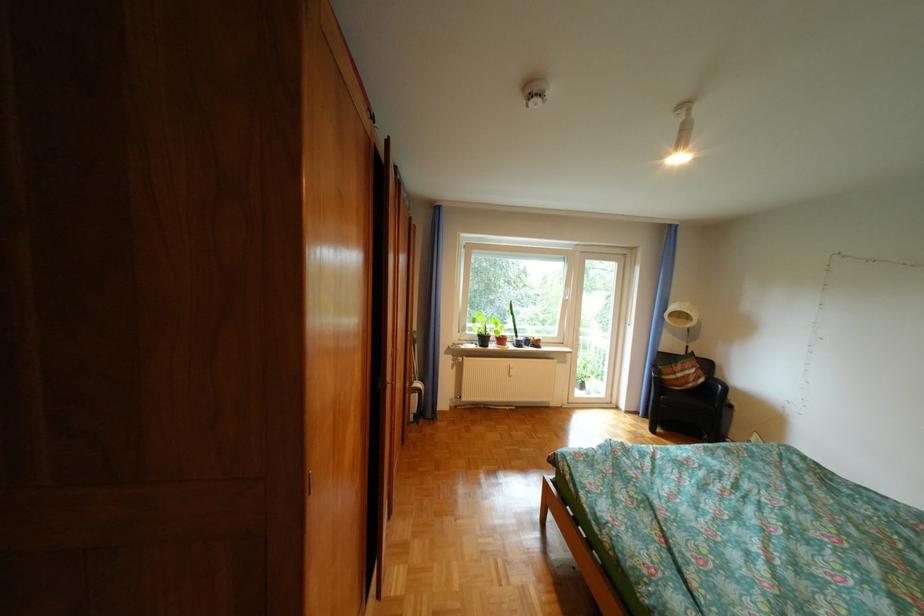
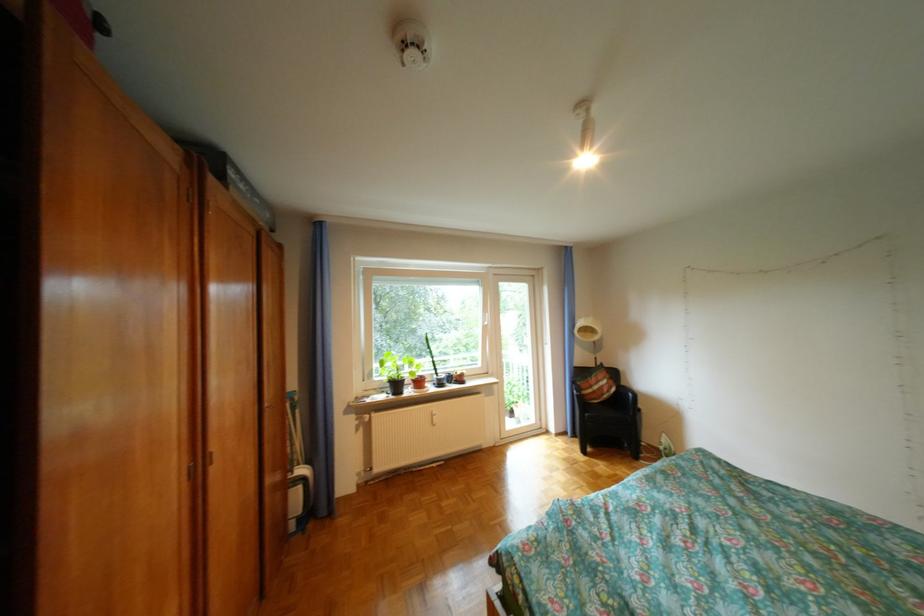
Find the pixel in the second image that matches point (492, 339) in the first image.

(403, 386)